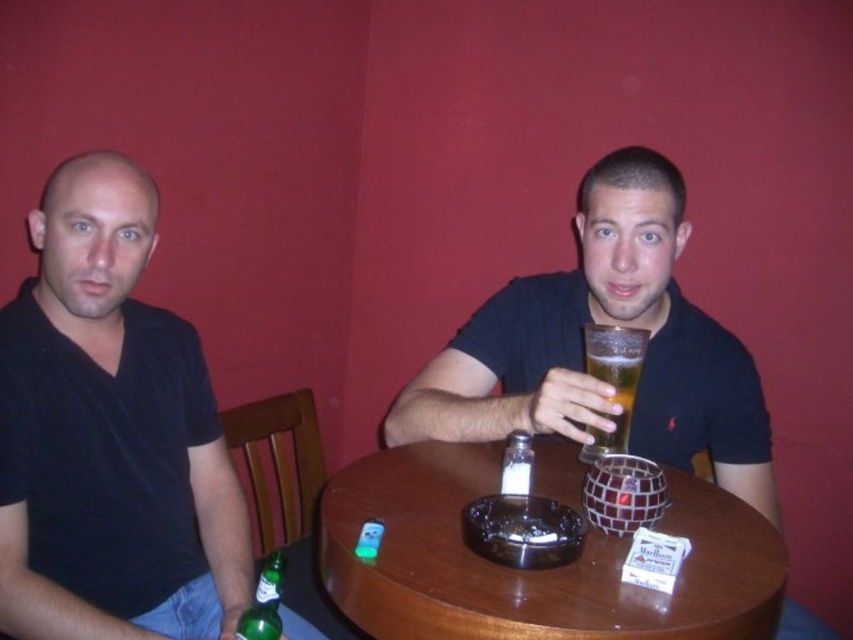
Which is above, matte black shirt at center or clear glass salt shaker at center?

matte black shirt at center is above.

From the picture: Can you confirm if matte black shirt at center is shorter than clear glass salt shaker at center?

Incorrect, matte black shirt at center's height does not fall short of clear glass salt shaker at center's.

Describe the element at coordinates (583, 349) in the screenshot. I see `matte black shirt at center` at that location.

Identify the location of matte black shirt at center. (583, 349).

Is point (15, 396) more distant than point (508, 465)?

No.

Is black matte shirt at left closer to the viewer compared to clear glass salt shaker at center?

Yes, it is in front of clear glass salt shaker at center.

Where is `black matte shirt at left`? The height and width of the screenshot is (640, 853). black matte shirt at left is located at coordinates (109, 428).

Describe the element at coordinates (583, 349) in the screenshot. I see `matte black shirt at center` at that location.

Does matte black shirt at center have a greater width compared to wooden round table at center?

Indeed, matte black shirt at center has a greater width compared to wooden round table at center.

Is point (476, 340) farther from viewer compared to point (654, 604)?

That is True.

The image size is (853, 640). In order to click on matte black shirt at center in this screenshot , I will do `click(583, 349)`.